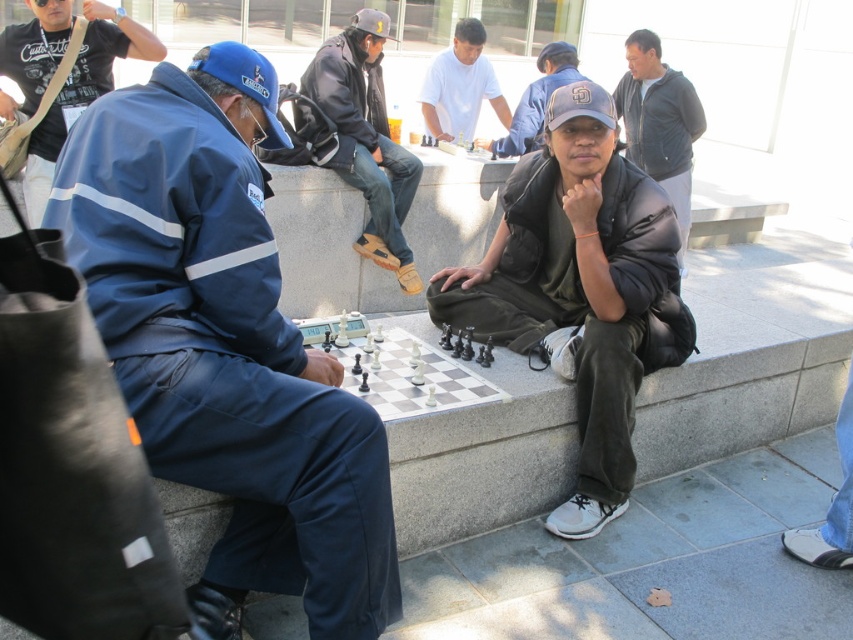
Question: Which point is closer to the camera?

Choices:
 (A) (482, 64)
 (B) (668, 122)

Answer: (B)

Question: Can you confirm if blue fabric jacket at left is positioned to the left of dark gray hoodie at upper right?

Choices:
 (A) no
 (B) yes

Answer: (B)

Question: Based on their relative distances, which object is nearer to the white plastic chess set at center?

Choices:
 (A) dark gray hoodie at upper right
 (B) white matte shirt at center
 (C) dark brown leather jacket at center
 (D) dark gray baseball cap at center

Answer: (C)

Question: Can you confirm if black matte jacket at center is positioned to the right of white matte shirt at center?

Choices:
 (A) yes
 (B) no

Answer: (A)

Question: Is blue fabric jacket at left behind dark gray hoodie at upper right?

Choices:
 (A) yes
 (B) no

Answer: (B)

Question: Among these objects, which one is nearest to the camera?

Choices:
 (A) blue fabric jacket at left
 (B) black matte jacket at center

Answer: (A)